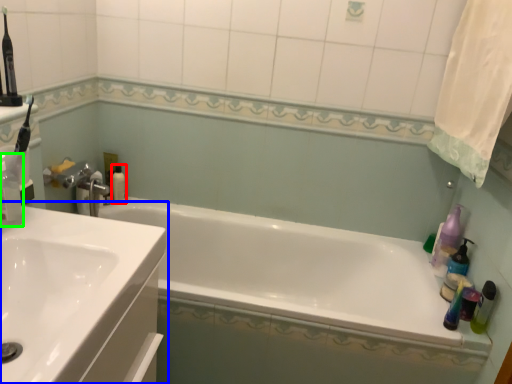
Question: Estimate the real-world distances between objects in this image. Which object is farther from mouthwash (highlighted by a red box), sink (highlighted by a blue box) or cleaning product (highlighted by a green box)?

Choices:
 (A) sink
 (B) cleaning product

Answer: (A)